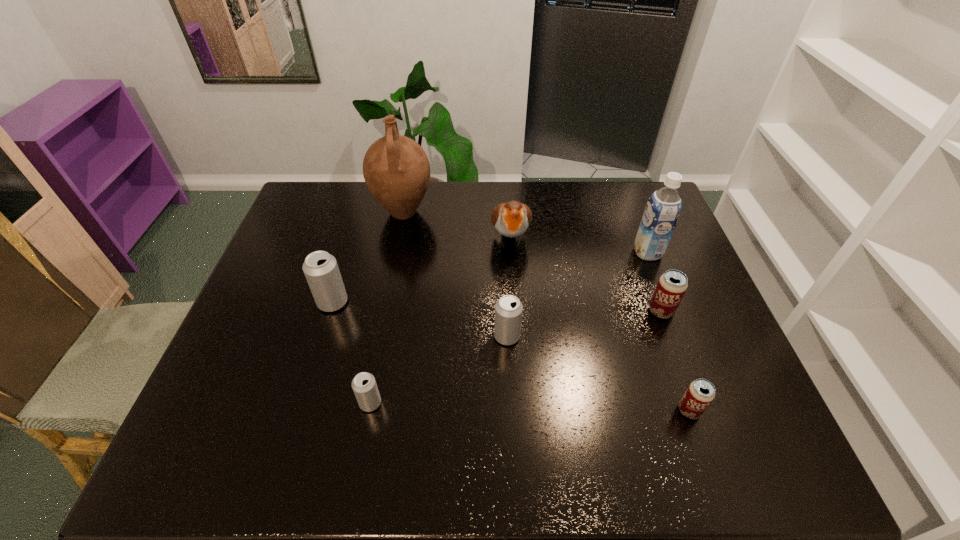
Identify the location of free location at the far right corner. (x=641, y=197).

You are a GUI agent. You are given a task and a screenshot of the screen. Output one action in this format:
    pyautogui.click(x=<x>, y=<y>)
    Task: Click on the free space between the smaller red beer can and the seventh shortest object
    Image resolution: width=960 pixels, height=540 pixels.
    Given the screenshot: What is the action you would take?
    pyautogui.click(x=668, y=332)

At what (x,y) coordinates should I click in order to perform the action: click on free space between the soya milk and the rightmost white beer can. Please return your answer as a coordinate pair (x, y). Looking at the image, I should click on (577, 294).

This screenshot has height=540, width=960. I want to click on free space between the soya milk and the tallest object, so click(x=525, y=232).

You are a GUI agent. You are given a task and a screenshot of the screen. Output one action in this format:
    pyautogui.click(x=<x>, y=<y>)
    Task: Click on the vacant region between the third beer can from right to left and the brown pitcher
    The image size is (960, 540).
    Given the screenshot: What is the action you would take?
    pyautogui.click(x=455, y=274)

Find the location of a particular element. vacant space that's between the biggest white beer can and the second beer can from left to right is located at coordinates (351, 353).

Where is `empty location between the smallest white beer can and the second biggest white beer can`? Image resolution: width=960 pixels, height=540 pixels. empty location between the smallest white beer can and the second biggest white beer can is located at coordinates (439, 369).

Locate an element on the screen. The width and height of the screenshot is (960, 540). unoccupied area between the second tallest object and the nearer red beer can is located at coordinates (668, 332).

I want to click on vacant region between the bigger red beer can and the pitcher, so click(532, 262).

Find the location of a particular element. vacant area between the rightmost white beer can and the brown pitcher is located at coordinates (455, 274).